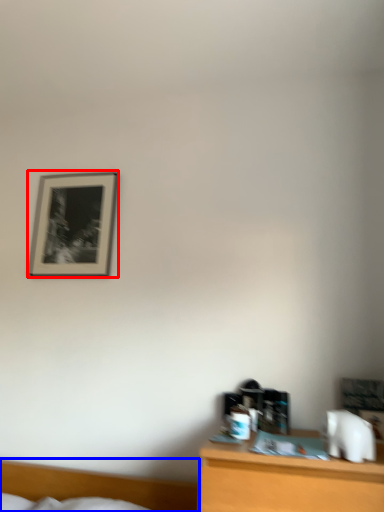
Question: Which of the following is the closest to the observer, picture frame (highlighted by a red box) or bed (highlighted by a blue box)?

Choices:
 (A) picture frame
 (B) bed

Answer: (B)